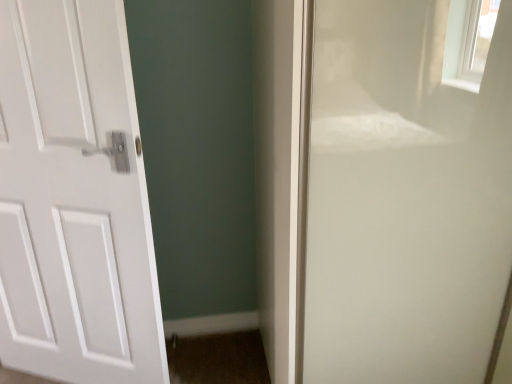
Image resolution: width=512 pixels, height=384 pixels. In order to click on transparent glass screen door at right in this screenshot , I will do `click(404, 199)`.

What is the approximate width of transparent glass screen door at right?

The width of transparent glass screen door at right is 32.38 inches.

Measure the distance between transparent glass screen door at right and camera.

transparent glass screen door at right and camera are 35.39 inches apart from each other.

This screenshot has width=512, height=384. What do you see at coordinates (404, 199) in the screenshot?
I see `transparent glass screen door at right` at bounding box center [404, 199].

What are the coordinates of `white matte door at left` in the screenshot? It's located at (74, 199).

Describe the element at coordinates (74, 199) in the screenshot. Image resolution: width=512 pixels, height=384 pixels. I see `white matte door at left` at that location.

This screenshot has height=384, width=512. What are the coordinates of `transparent glass screen door at right` in the screenshot? It's located at (404, 199).

Considering the positions of objects white matte door at left and transparent glass screen door at right in the image provided, who is more to the left, white matte door at left or transparent glass screen door at right?

Positioned to the left is white matte door at left.

Which is in front, white matte door at left or transparent glass screen door at right?

Positioned in front is transparent glass screen door at right.

Is point (12, 125) positioned before point (310, 209)?

No, (12, 125) is further to viewer.

From the image's perspective, is white matte door at left positioned above or below transparent glass screen door at right?

white matte door at left is situated lower than transparent glass screen door at right in the image.

From a real-world perspective, is white matte door at left located higher than transparent glass screen door at right?

Correct, in the physical world, white matte door at left is higher than transparent glass screen door at right.

Between white matte door at left and transparent glass screen door at right, which one has larger width?

transparent glass screen door at right is wider.

In terms of height, does white matte door at left look taller or shorter compared to transparent glass screen door at right?

Clearly, white matte door at left is shorter compared to transparent glass screen door at right.

Considering the relative sizes of white matte door at left and transparent glass screen door at right in the image provided, is white matte door at left bigger than transparent glass screen door at right?

No.

Is white matte door at left not within transparent glass screen door at right?

Yes.

Are white matte door at left and transparent glass screen door at right far apart?

No, there isn't a large distance between white matte door at left and transparent glass screen door at right.

Is white matte door at left turned away from transparent glass screen door at right?

white matte door at left is not turned away from transparent glass screen door at right.

This screenshot has height=384, width=512. Identify the location of screen door on the right of white matte door at left. [x=404, y=199].

Based on their positions, is transparent glass screen door at right located to the left or right of white matte door at left?

From the image, it's evident that transparent glass screen door at right is to the right of white matte door at left.

Which is in front, transparent glass screen door at right or white matte door at left?

transparent glass screen door at right is closer to the camera.

Considering the positions of points (367, 302) and (115, 126), is point (367, 302) farther from camera compared to point (115, 126)?

Yes, it is behind point (115, 126).

From the image's perspective, which one is positioned higher, transparent glass screen door at right or white matte door at left?

From the image's view, transparent glass screen door at right is above.

From a real-world perspective, is transparent glass screen door at right above or below white matte door at left?

transparent glass screen door at right is below white matte door at left.

Is transparent glass screen door at right wider or thinner than white matte door at left?

Clearly, transparent glass screen door at right has more width compared to white matte door at left.

Who is shorter, transparent glass screen door at right or white matte door at left?

With less height is white matte door at left.

Considering the relative sizes of transparent glass screen door at right and white matte door at left in the image provided, is transparent glass screen door at right bigger than white matte door at left?

Yes, transparent glass screen door at right is bigger than white matte door at left.

Is transparent glass screen door at right spatially inside white matte door at left, or outside of it?

transparent glass screen door at right lies outside white matte door at left.

Can you see transparent glass screen door at right touching white matte door at left?

No.

Could you tell me if transparent glass screen door at right is turned towards white matte door at left?

No.

How many degrees apart are the facing directions of transparent glass screen door at right and white matte door at left?

There is a 22.6-degree angle between the facing directions of transparent glass screen door at right and white matte door at left.

Measure the distance from transparent glass screen door at right to white matte door at left.

A distance of 30.18 inches exists between transparent glass screen door at right and white matte door at left.

At what (x,y) coordinates should I click in order to perform the action: click on door behind the transparent glass screen door at right. Please return your answer as a coordinate pair (x, y). The image size is (512, 384). Looking at the image, I should click on (74, 199).

Where is `screen door above the white matte door at left (from the image's perspective)`? screen door above the white matte door at left (from the image's perspective) is located at coordinates (404, 199).

Locate an element on the screen. screen door that is under the white matte door at left (from a real-world perspective) is located at coordinates (404, 199).